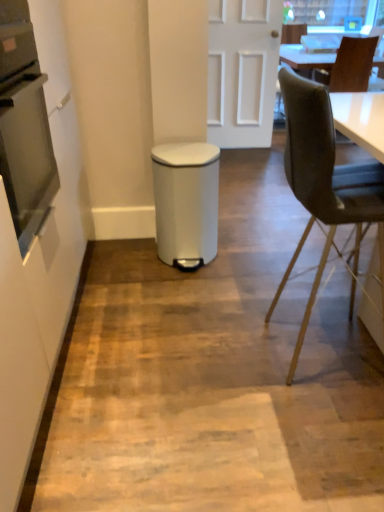
Where is `blank area to the left of white plastic waste bin at center`? blank area to the left of white plastic waste bin at center is located at coordinates (133, 261).